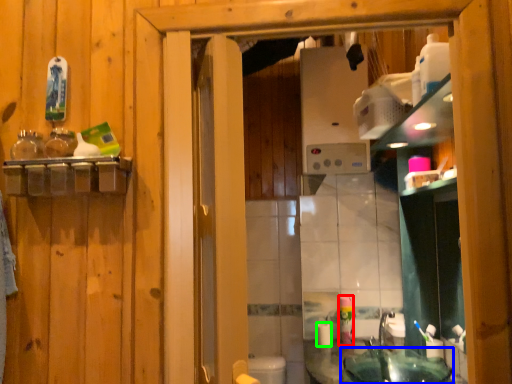
Question: Which is nearer to the mouthwash (highlighted by a red box)? sink (highlighted by a blue box) or toilet paper (highlighted by a green box).

Choices:
 (A) sink
 (B) toilet paper

Answer: (B)